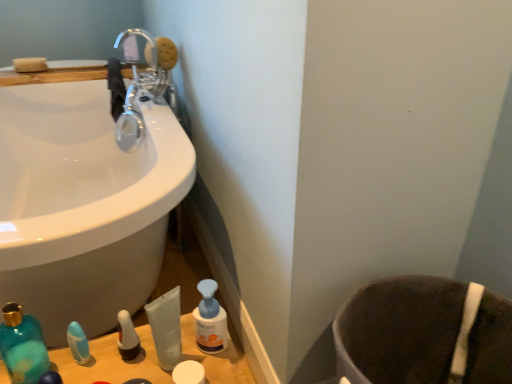
Question: Should I look upward or downward to see teal glass mouthwash at lower left?

Choices:
 (A) down
 (B) up

Answer: (A)

Question: Is white matte container at lower center, the 4th toiletry when ordered from left to right, completely or partially inside translucent plastic pump bottle at lower left, positioned as the second toiletry in left-to-right order?

Choices:
 (A) yes
 (B) no

Answer: (B)

Question: Can you confirm if translucent plastic pump bottle at lower left, the third toiletry positioned from the right, is shorter than white matte container at lower center, the 1th toiletry in the right-to-left sequence?

Choices:
 (A) no
 (B) yes

Answer: (A)

Question: Considering the relative sizes of translucent plastic pump bottle at lower left, the third toiletry positioned from the right, and white matte container at lower center, the 1th toiletry in the right-to-left sequence, in the image provided, is translucent plastic pump bottle at lower left, the third toiletry positioned from the right, thinner than white matte container at lower center, the 1th toiletry in the right-to-left sequence,?

Choices:
 (A) yes
 (B) no

Answer: (A)

Question: Is the position of translucent plastic pump bottle at lower left, positioned as the second toiletry in left-to-right order, more distant than that of white matte container at lower center, the 1th toiletry in the right-to-left sequence?

Choices:
 (A) yes
 (B) no

Answer: (A)

Question: Could you tell me if translucent plastic pump bottle at lower left, positioned as the second toiletry in left-to-right order, is turned towards white matte container at lower center, the 1th toiletry in the right-to-left sequence?

Choices:
 (A) yes
 (B) no

Answer: (B)

Question: From the image's perspective, is translucent plastic pump bottle at lower left, positioned as the second toiletry in left-to-right order, beneath white matte container at lower center, the 4th toiletry when ordered from left to right?

Choices:
 (A) no
 (B) yes

Answer: (A)

Question: From the image's perspective, is brown fabric toilet bowl at lower right above white matte container at lower center, the 1th toiletry in the right-to-left sequence?

Choices:
 (A) yes
 (B) no

Answer: (B)

Question: Is brown fabric toilet bowl at lower right oriented towards white matte container at lower center, the 1th toiletry in the right-to-left sequence?

Choices:
 (A) yes
 (B) no

Answer: (A)

Question: Considering the relative sizes of brown fabric toilet bowl at lower right and white matte container at lower center, the 4th toiletry when ordered from left to right, in the image provided, is brown fabric toilet bowl at lower right bigger than white matte container at lower center, the 4th toiletry when ordered from left to right,?

Choices:
 (A) no
 (B) yes

Answer: (B)

Question: Is brown fabric toilet bowl at lower right positioned in front of white matte container at lower center, the 1th toiletry in the right-to-left sequence?

Choices:
 (A) no
 (B) yes

Answer: (B)

Question: Does brown fabric toilet bowl at lower right have a lesser height compared to white matte container at lower center, the 4th toiletry when ordered from left to right?

Choices:
 (A) no
 (B) yes

Answer: (A)

Question: Is brown fabric toilet bowl at lower right positioned with its back to white matte container at lower center, the 1th toiletry in the right-to-left sequence?

Choices:
 (A) yes
 (B) no

Answer: (B)

Question: Could you tell me if blue plastic pump bottle at lower center is facing chrome metallic faucet at upper left?

Choices:
 (A) no
 (B) yes

Answer: (A)